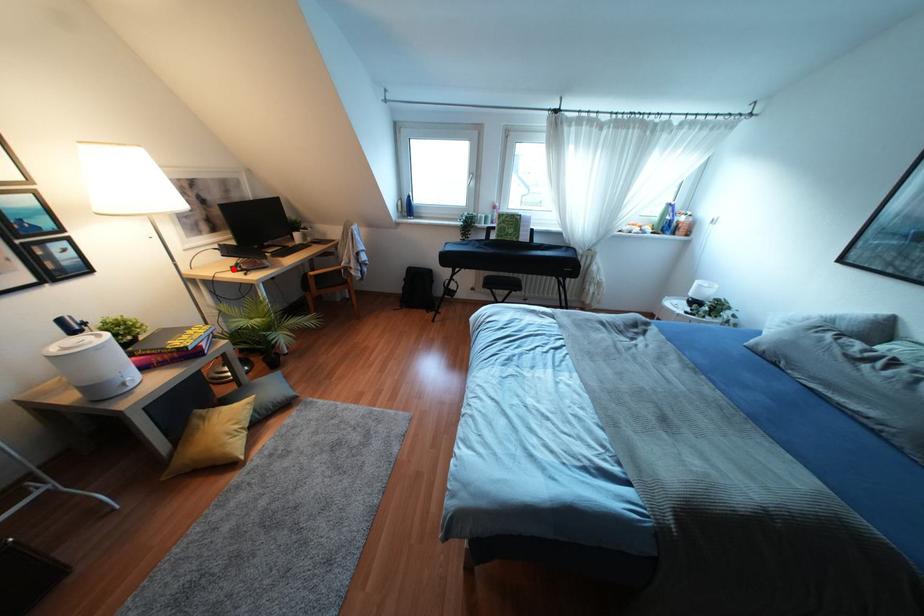
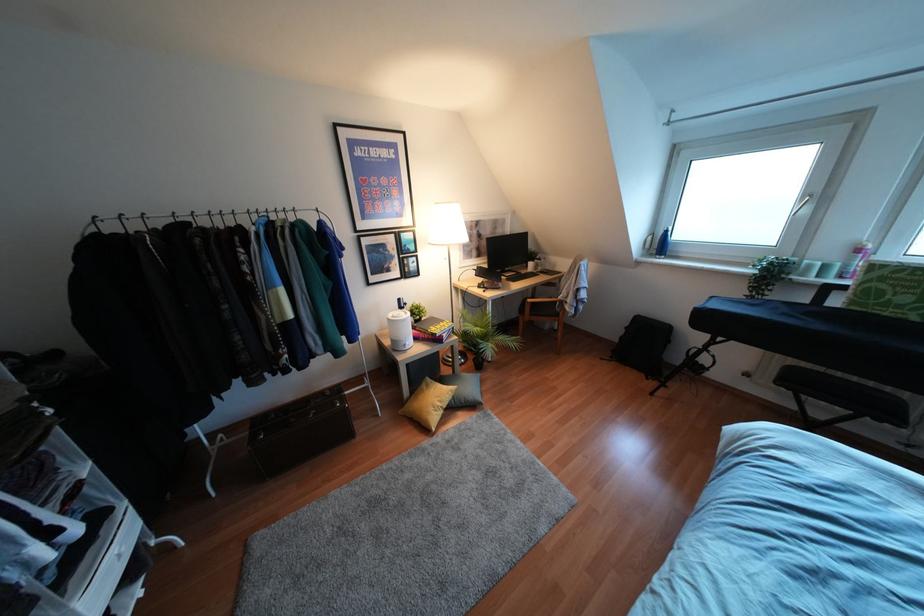
Where in the second image is the point corresponding to the highlighted location from the first image?

(478, 286)